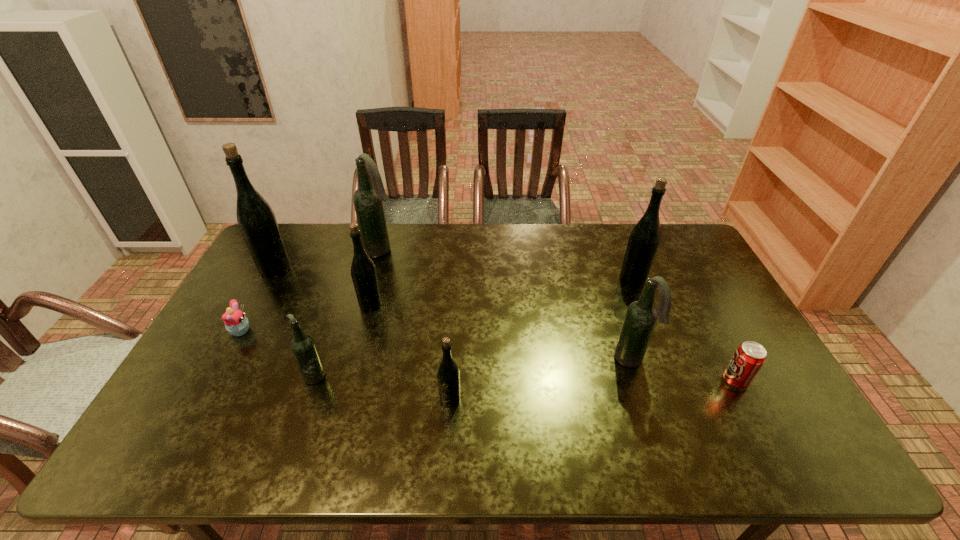
Locate an element on the screen. This screenshot has height=540, width=960. vacant area between the smallest green beer bottle and the farthest dark beer bottle is located at coordinates (416, 325).

This screenshot has width=960, height=540. Find the location of `free space between the eighth object from left to right and the rightmost object`. free space between the eighth object from left to right and the rightmost object is located at coordinates (684, 330).

This screenshot has width=960, height=540. I want to click on vacant space that's between the tallest beer bottle and the rightmost object, so click(x=506, y=325).

Identify which object is located as the third nearest to the second biggest green beer bottle. Please provide its 2D coordinates. Your answer should be formatted as a tuple, i.e. [(x, y)], where the tuple contains the x and y coordinates of a point satisfying the conditions above.

[(448, 376)]

Locate which object ranks in proximity to the farthest dark beer bottle. Please provide its 2D coordinates. Your answer should be formatted as a tuple, i.e. [(x, y)], where the tuple contains the x and y coordinates of a point satisfying the conditions above.

[(363, 270)]

Identify which beer bottle is the third nearest to the nearest beer bottle. Please provide its 2D coordinates. Your answer should be formatted as a tuple, i.e. [(x, y)], where the tuple contains the x and y coordinates of a point satisfying the conditions above.

[(641, 316)]

Find the location of `beer bottle identified as the fourth closest to the second nearest green beer bottle`. beer bottle identified as the fourth closest to the second nearest green beer bottle is located at coordinates (448, 376).

Locate which green beer bottle ranks in proximity to the fifth nearest object. Please provide its 2D coordinates. Your answer should be formatted as a tuple, i.e. [(x, y)], where the tuple contains the x and y coordinates of a point satisfying the conditions above.

[(256, 220)]

In order to click on green beer bottle identified as the third closest to the farthest dark beer bottle in this screenshot , I will do `click(448, 376)`.

Locate an element on the screen. This screenshot has width=960, height=540. dark beer bottle identified as the closest to the leftmost green beer bottle is located at coordinates click(368, 199).